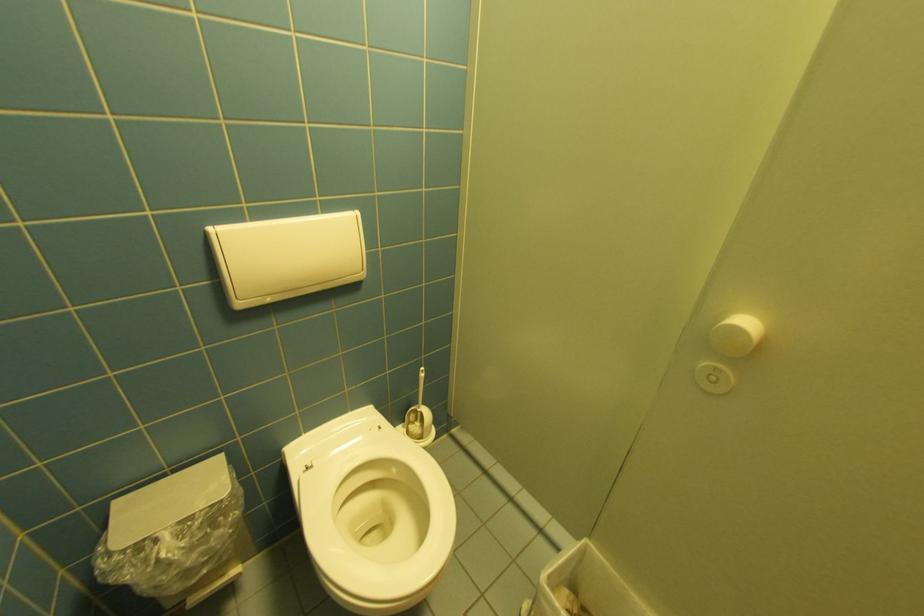
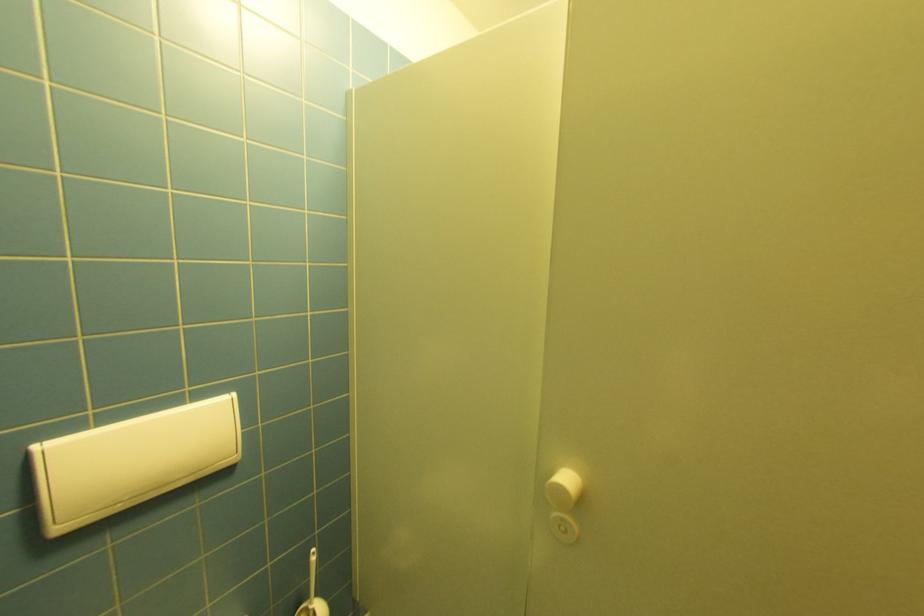
Which direction would the cameraman need to move to produce the second image?

The cameraman moved toward right, backward.